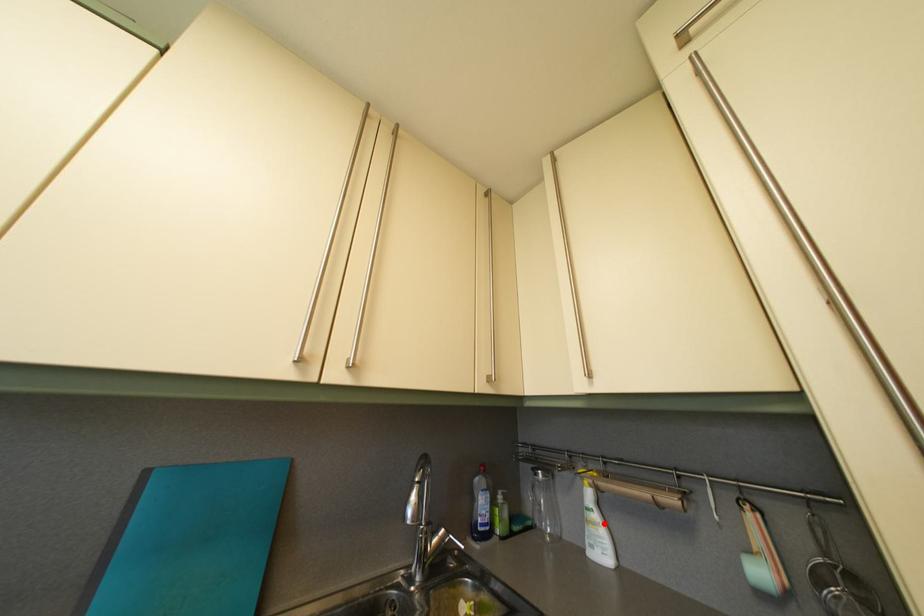
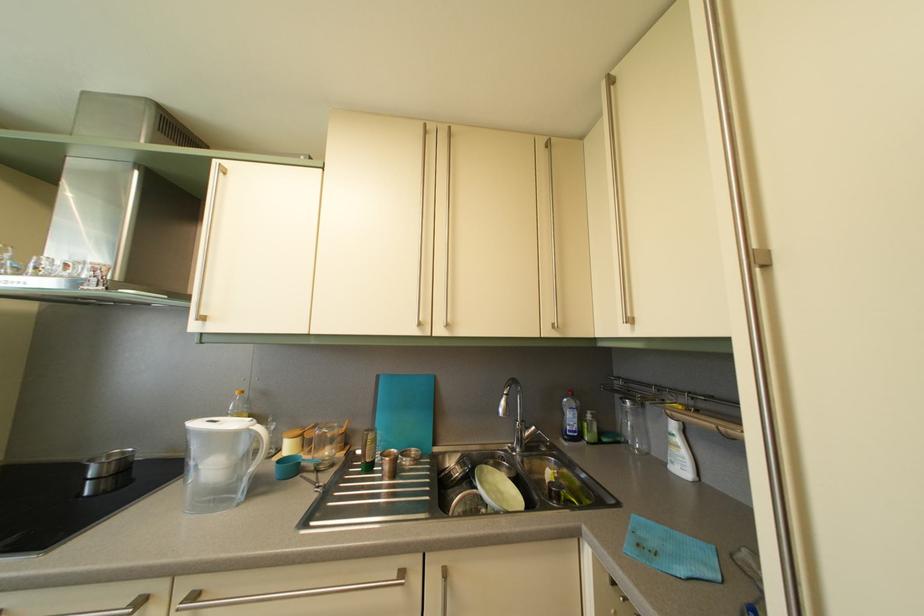
Find the pixel in the second image that matches the highlighted location in the first image.

(687, 448)